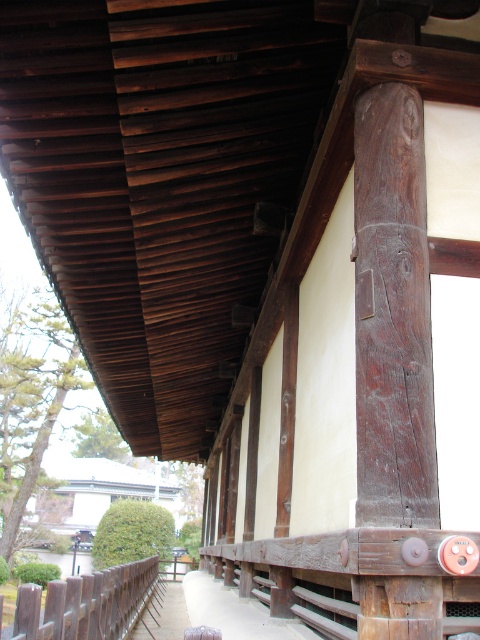
In the scene shown: You are standing in front of the traditional wooden structure and want to take a photo. You notice two points marked on the structure. Which point is closer to your camera lens when taking the photo? Please choose between point (422, 464) and point (121, 592).

Point (422, 464) is closer to the camera lens than point (121, 592).

You are an architect examining the traditional wooden structure. You need to determine which object has a smaller width between the dark brown wood at center and the brown wooden rail at lower left. Based on the structure shown, which one is narrower?

The dark brown wood at center has a lesser width compared to the brown wooden rail at lower left, so the dark brown wood at center is narrower.

You are a construction inspector examining a traditional wooden structure. You notice a point marked at coordinates point (393, 314). Based on the scene, what material is present at this location?

The dark brown wood at center is represented by point (393, 314), so the material at this location is dark brown wood.